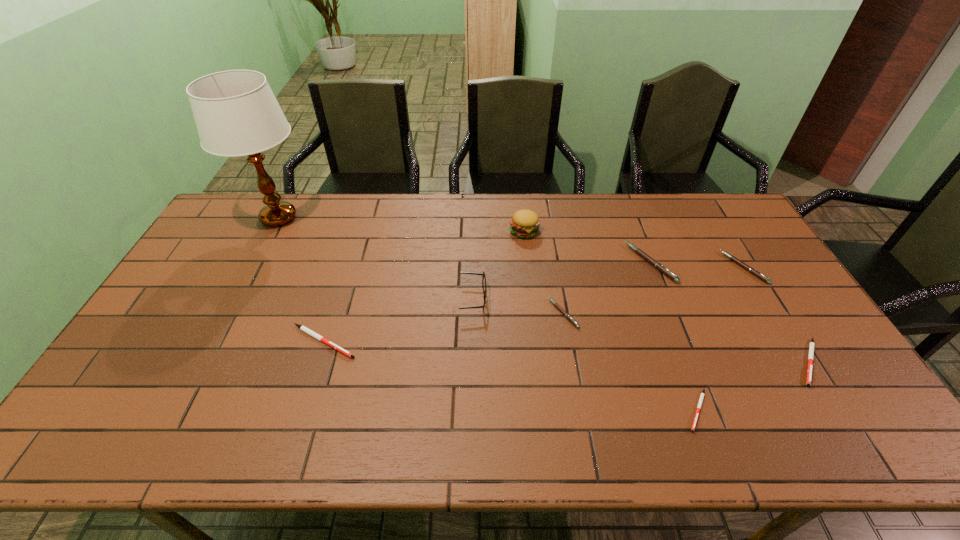
You are a GUI agent. You are given a task and a screenshot of the screen. Output one action in this format:
    pyautogui.click(x=<x>, y=<y>)
    Task: Click on the free space between the hamburger and the biggest white pen
    
    Given the screenshot: What is the action you would take?
    pyautogui.click(x=423, y=286)

Locate an element on the screen. vacant point located between the leftmost pen and the second biggest pink pen is located at coordinates click(x=534, y=305).

This screenshot has width=960, height=540. Identify the location of free point between the rightmost white pen and the fourth tallest object. (730, 312).

This screenshot has width=960, height=540. Identify the location of free spot between the rightmost white pen and the spectacles. (641, 330).

Find the location of `free space between the sixth shortest object and the rightmost white pen`. free space between the sixth shortest object and the rightmost white pen is located at coordinates (730, 312).

Where is `free space between the black spectacles and the leftmost pink pen`? free space between the black spectacles and the leftmost pink pen is located at coordinates (518, 306).

Where is `free space between the leftmost pink pen and the leftmost pen`? free space between the leftmost pink pen and the leftmost pen is located at coordinates (444, 327).

Find the location of a particular element. The height and width of the screenshot is (540, 960). vacant region between the tallest object and the eighth shortest object is located at coordinates (401, 224).

Where is `free space between the table lamp and the hamburger`? The image size is (960, 540). free space between the table lamp and the hamburger is located at coordinates (401, 224).

Where is `free point between the seventh object from right to left and the biggest pink pen`? The image size is (960, 540). free point between the seventh object from right to left and the biggest pink pen is located at coordinates (562, 281).